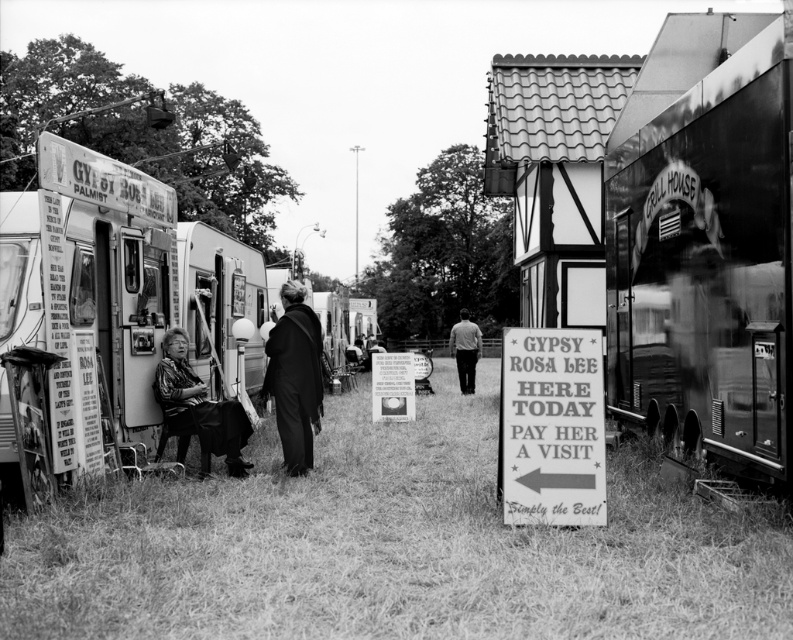
Does dark fabric chair at left have a lesser height compared to smooth gray shirt at center?

Yes.

Between dark fabric chair at left and smooth gray shirt at center, which one has less height?

dark fabric chair at left

Does point (209, 422) come behind point (469, 369)?

No, (209, 422) is in front of (469, 369).

Where is `dark fabric chair at left`? dark fabric chair at left is located at coordinates (198, 410).

Is white paper sign at center to the right of smooth gray shirt at center from the viewer's perspective?

Incorrect, white paper sign at center is not on the right side of smooth gray shirt at center.

This screenshot has width=793, height=640. Describe the element at coordinates (393, 387) in the screenshot. I see `white paper sign at center` at that location.

In order to click on white paper sign at center in this screenshot , I will do `click(393, 387)`.

Which is in front, point (127, 339) or point (481, 340)?

Point (127, 339)

Who is lower down, rustic wood food truck at left or smooth gray shirt at center?

smooth gray shirt at center is lower down.

Identify the location of rustic wood food truck at left. The image size is (793, 640). (144, 276).

Locate an element on the screen. rustic wood food truck at left is located at coordinates (144, 276).